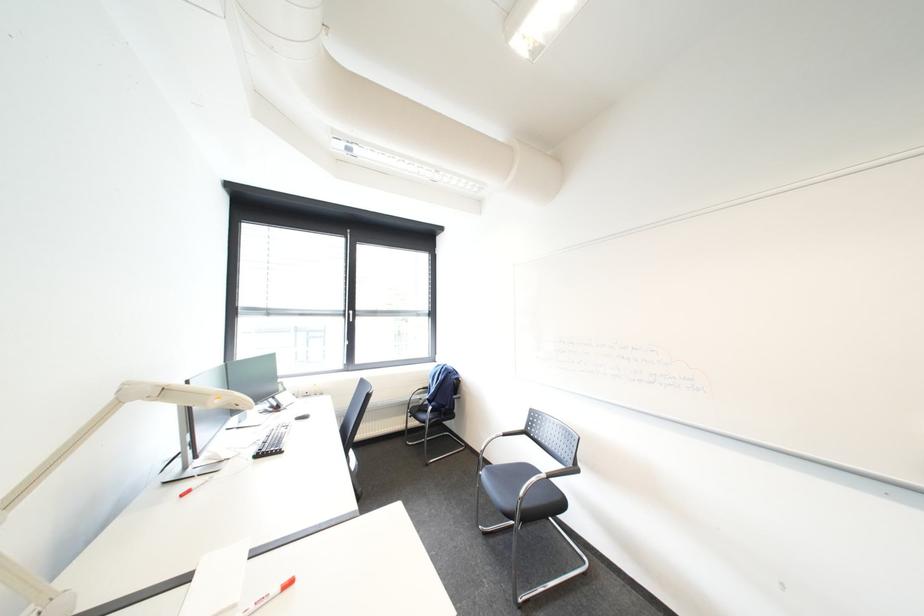
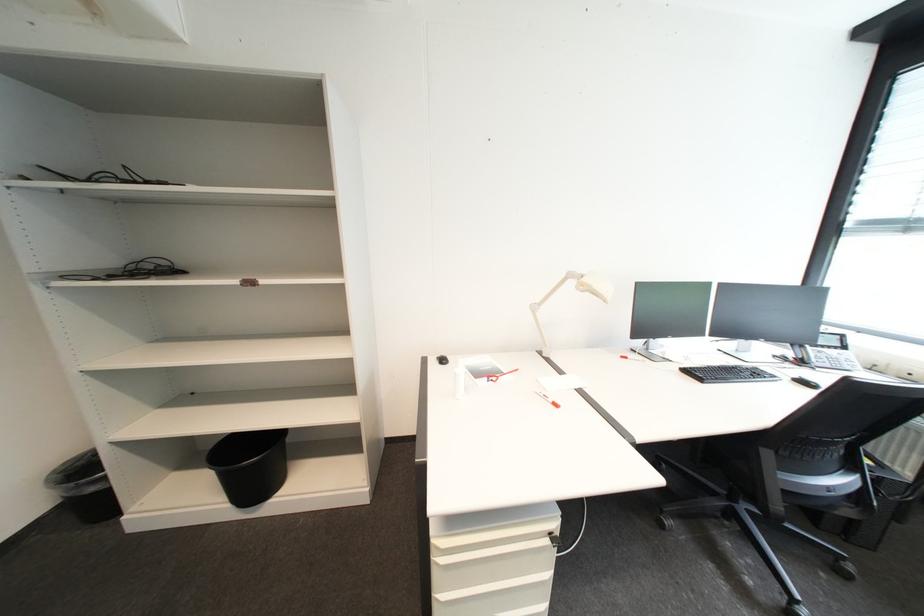
Question: The images are taken continuously from a first-person perspective. In which direction is your viewpoint rotating?

Choices:
 (A) Left
 (B) Right
 (C) Up
 (D) Down

Answer: (A)